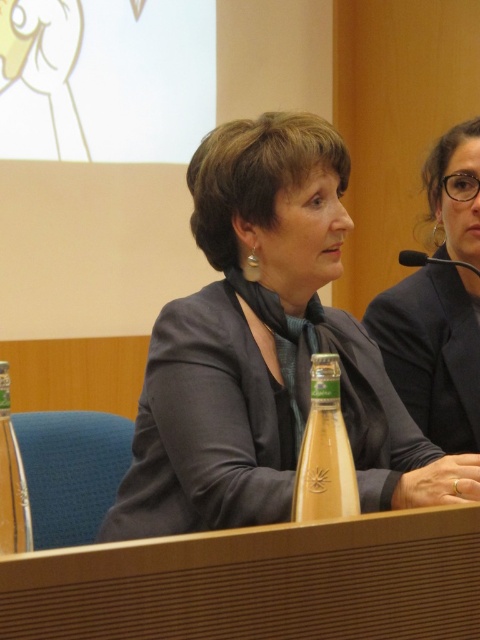
Question: Where is matte gray blazer at center located in relation to wooden at center in the image?

Choices:
 (A) left
 (B) right

Answer: (A)

Question: Which of these objects is positioned farthest from the wooden at center?

Choices:
 (A) matte gray blazer at center
 (B) clear glass bottle at center
 (C) clear glass bottle at left

Answer: (A)

Question: Does matte gray blazer at center appear on the right side of wooden at center?

Choices:
 (A) yes
 (B) no

Answer: (B)

Question: Based on their relative distances, which object is nearer to the clear glass bottle at left?

Choices:
 (A) wooden at center
 (B) clear glass bottle at center
 (C) matte gray blazer at center

Answer: (A)

Question: Which point appears farthest from the camera in this image?

Choices:
 (A) (323, 436)
 (B) (416, 550)
 (C) (9, 516)

Answer: (A)

Question: Is matte gray blazer at center wider than clear glass bottle at center?

Choices:
 (A) yes
 (B) no

Answer: (A)